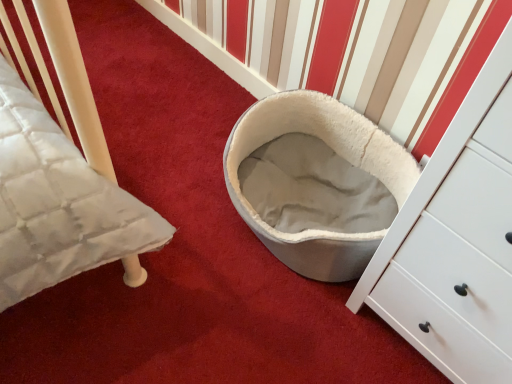
Question: Should I look upward or downward to see white plush pet bed at center?

Choices:
 (A) up
 (B) down

Answer: (A)